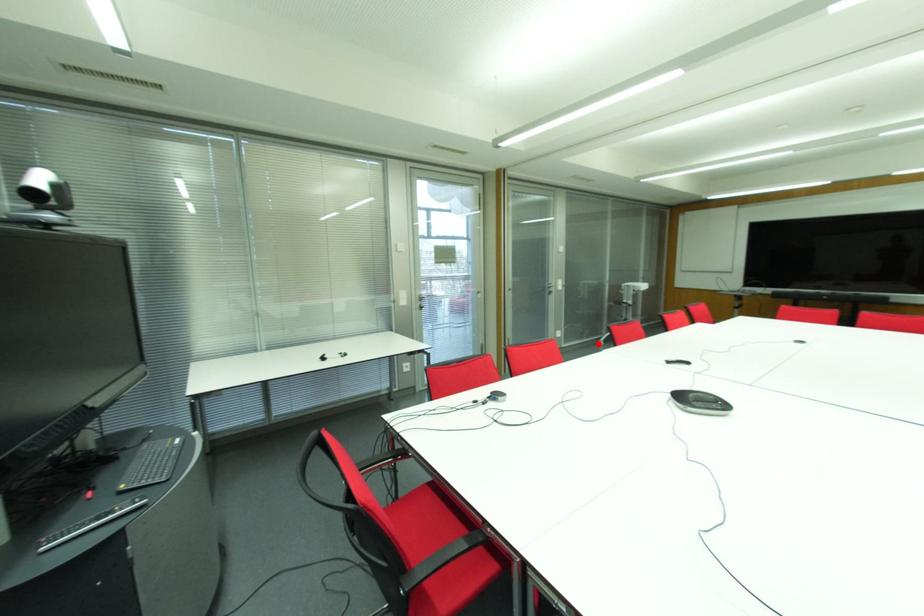
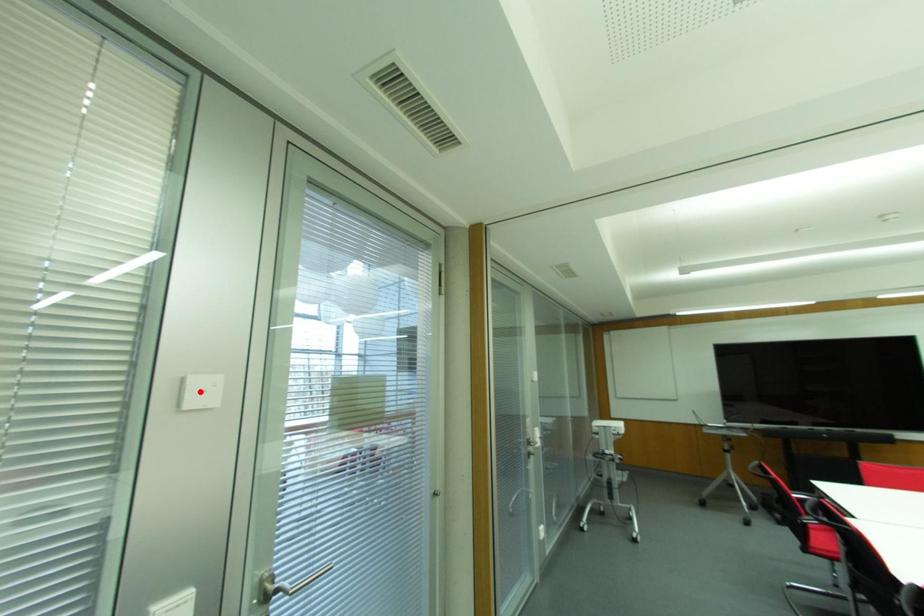
From the picture: I am providing you with two images of the same scene from different viewpoints. A red point is marked on the first image and another point is marked on the second image. Are the points marked in image1 and image2 representing the same 3D position?

No